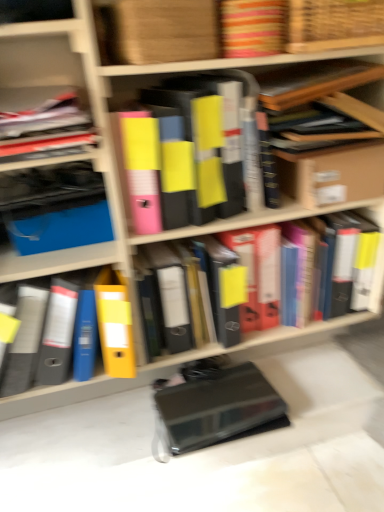
Question: Considering the relative sizes of yellow matte folder at center, acting as the 4th book starting from the top, and cardboard box at upper right in the image provided, is yellow matte folder at center, acting as the 4th book starting from the top, thinner than cardboard box at upper right?

Choices:
 (A) yes
 (B) no

Answer: (A)

Question: From a real-world perspective, is yellow matte folder at center, acting as the 4th book starting from the top, physically above cardboard box at upper right?

Choices:
 (A) no
 (B) yes

Answer: (A)

Question: Does yellow matte folder at center, which ranks as the 2th book in bottom-to-top order, have a smaller size compared to cardboard box at upper right?

Choices:
 (A) yes
 (B) no

Answer: (B)

Question: Can you confirm if yellow matte folder at center, acting as the 4th book starting from the top, is wider than cardboard box at upper right?

Choices:
 (A) no
 (B) yes

Answer: (A)

Question: From the image's perspective, is yellow matte folder at center, acting as the 4th book starting from the top, over cardboard box at upper right?

Choices:
 (A) yes
 (B) no

Answer: (B)

Question: Is yellow matte folder at center, acting as the 4th book starting from the top, next to cardboard box at upper right and touching it?

Choices:
 (A) no
 (B) yes

Answer: (A)

Question: From a real-world perspective, is yellow matte folder at center, which is the fifth book from top to bottom, physically below black matte book at lower center?

Choices:
 (A) yes
 (B) no

Answer: (B)

Question: Is yellow matte folder at center, which is the fifth book from top to bottom, not inside black matte book at lower center?

Choices:
 (A) yes
 (B) no

Answer: (A)

Question: Does yellow matte folder at center, the 1th book in the bottom-to-top sequence, turn towards black matte book at lower center?

Choices:
 (A) no
 (B) yes

Answer: (A)

Question: Is yellow matte folder at center, which is the fifth book from top to bottom, in contact with black matte book at lower center?

Choices:
 (A) yes
 (B) no

Answer: (B)

Question: Is yellow matte folder at center, which is the fifth book from top to bottom, looking in the opposite direction of black matte book at lower center?

Choices:
 (A) yes
 (B) no

Answer: (B)

Question: Would you say black matte book at lower center is part of yellow matte folder at center, which is the fifth book from top to bottom,'s contents?

Choices:
 (A) yes
 (B) no

Answer: (B)

Question: From the image's perspective, does yellow matte folder at center, arranged as the third book when ordered from the bottom, appear lower than woven wood basket at upper center?

Choices:
 (A) no
 (B) yes

Answer: (B)